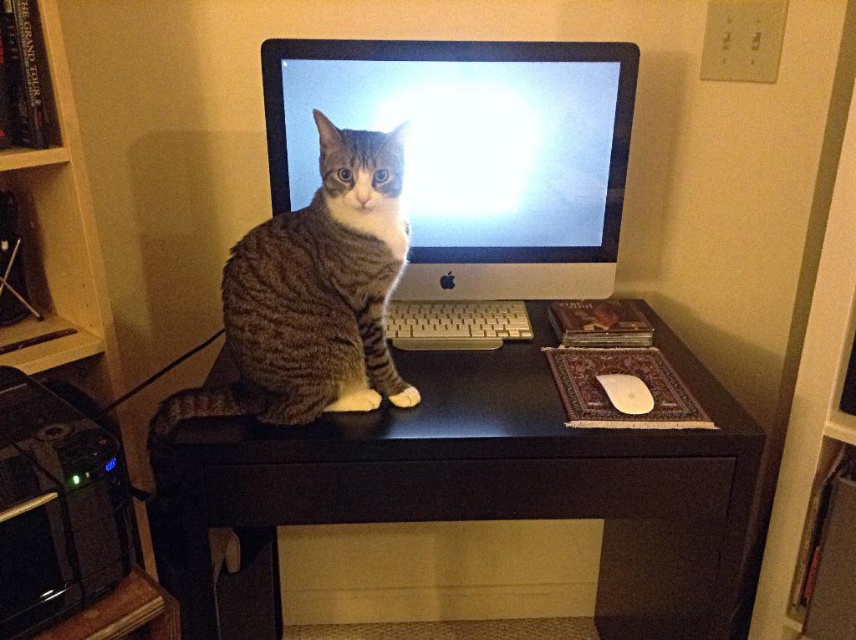
Question: Which of the following is the closest to the observer?

Choices:
 (A) (256, 428)
 (B) (302, 168)

Answer: (A)

Question: Which object appears farthest from the camera in this image?

Choices:
 (A) tabby fur cat at center
 (B) black matte computer desk at center
 (C) silver metallic keyboard at center

Answer: (C)

Question: Which object is the closest to the silver metallic keyboard at center?

Choices:
 (A) black matte computer desk at center
 (B) satin silver monitor at center
 (C) tabby fur cat at center

Answer: (B)

Question: Considering the relative positions of satin silver monitor at center and tabby fur cat at center in the image provided, where is satin silver monitor at center located with respect to tabby fur cat at center?

Choices:
 (A) right
 (B) left

Answer: (A)

Question: Is satin silver monitor at center positioned at the back of silver metallic keyboard at center?

Choices:
 (A) no
 (B) yes

Answer: (A)

Question: Is black matte computer desk at center thinner than silver metallic keyboard at center?

Choices:
 (A) no
 (B) yes

Answer: (A)